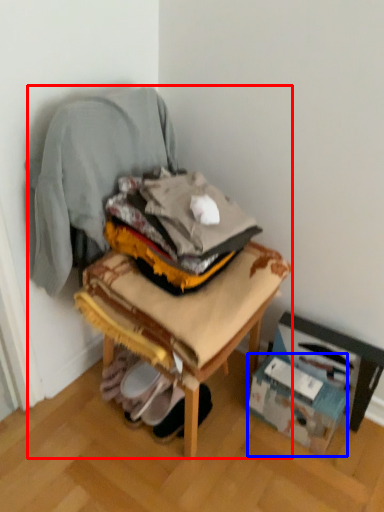
Question: Which of the following is the closest to the observer, chair (highlighted by a red box) or cardboard box (highlighted by a blue box)?

Choices:
 (A) chair
 (B) cardboard box

Answer: (A)